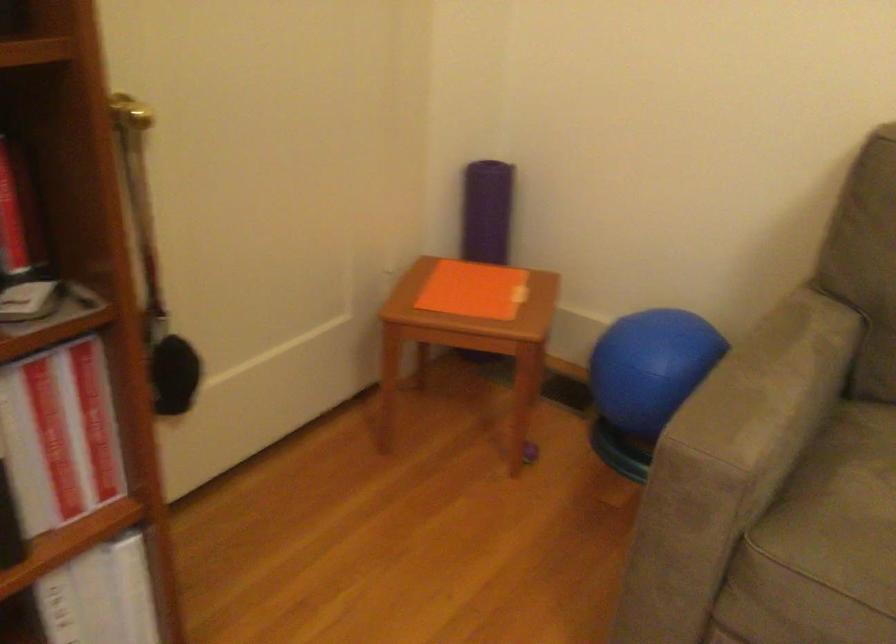
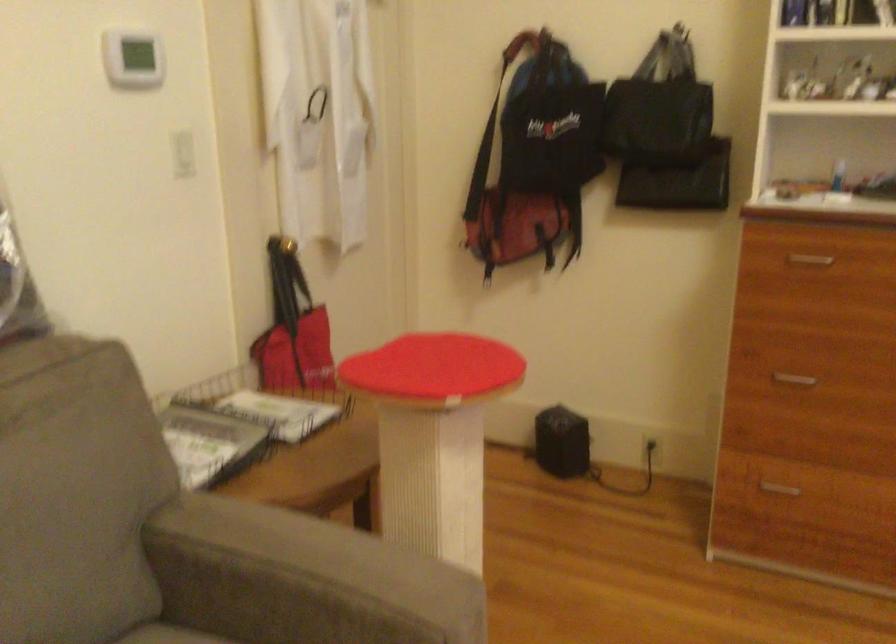
Based on the continuous images, in which direction is the camera rotating?

The camera's rotation is toward right-down.